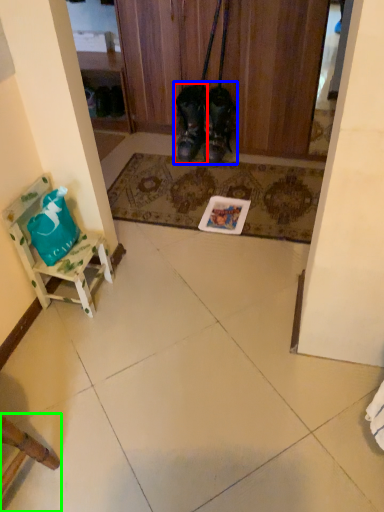
Question: Which object is positioned closest to footwear (highlighted by a red box)? Select from footwear (highlighted by a blue box) and chair (highlighted by a green box).

Choices:
 (A) footwear
 (B) chair

Answer: (A)